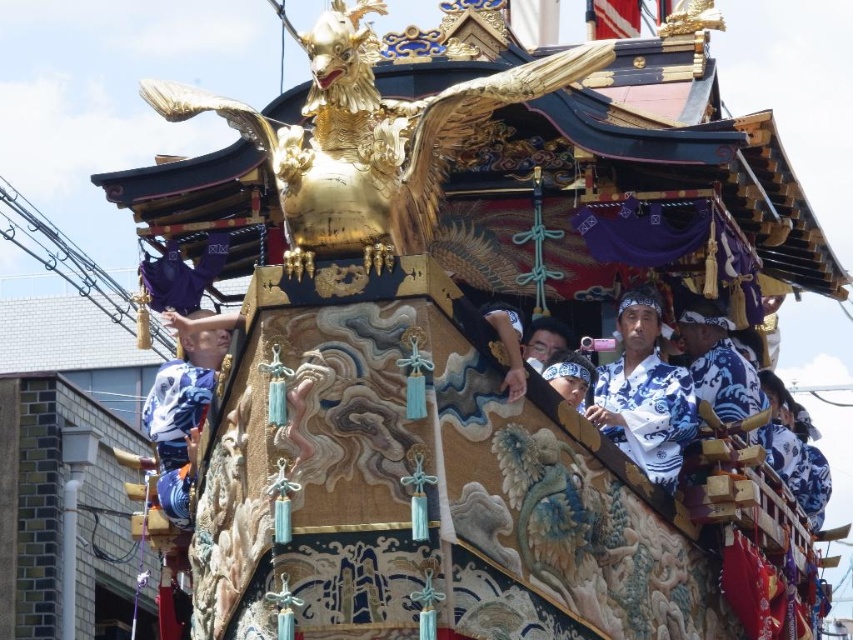
Question: Can you confirm if white cotton kimono at center is positioned above blue and white kimono at center?

Choices:
 (A) no
 (B) yes

Answer: (B)

Question: Which object is closer to the camera taking this photo?

Choices:
 (A) blue and white kimono at center
 (B) white cotton kimono at center

Answer: (A)

Question: Does white cotton kimono at center appear on the left side of blue and white kimono at center?

Choices:
 (A) yes
 (B) no

Answer: (B)

Question: Which point appears farthest from the camera in this image?

Choices:
 (A) (622, 384)
 (B) (218, 323)

Answer: (A)

Question: Can you confirm if white cotton kimono at center is thinner than blue and white kimono at center?

Choices:
 (A) no
 (B) yes

Answer: (B)